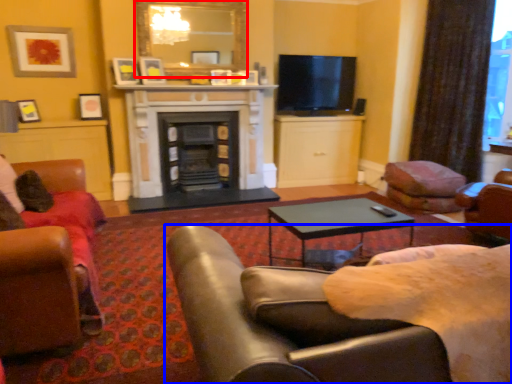
Question: Which of the following is the farthest to the observer, mirror (highlighted by a red box) or chair (highlighted by a blue box)?

Choices:
 (A) mirror
 (B) chair

Answer: (A)